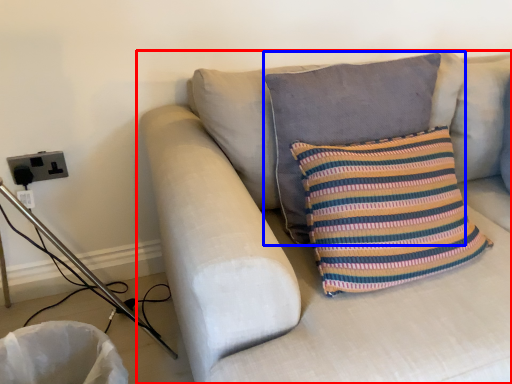
Question: Among these objects, which one is farthest to the camera, studio couch (highlighted by a red box) or pillow (highlighted by a blue box)?

Choices:
 (A) studio couch
 (B) pillow

Answer: (B)